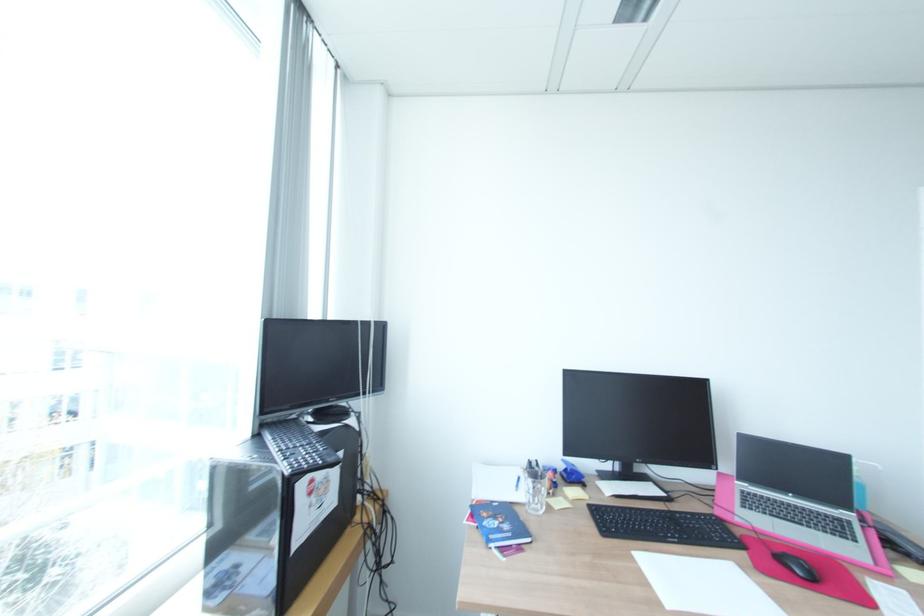
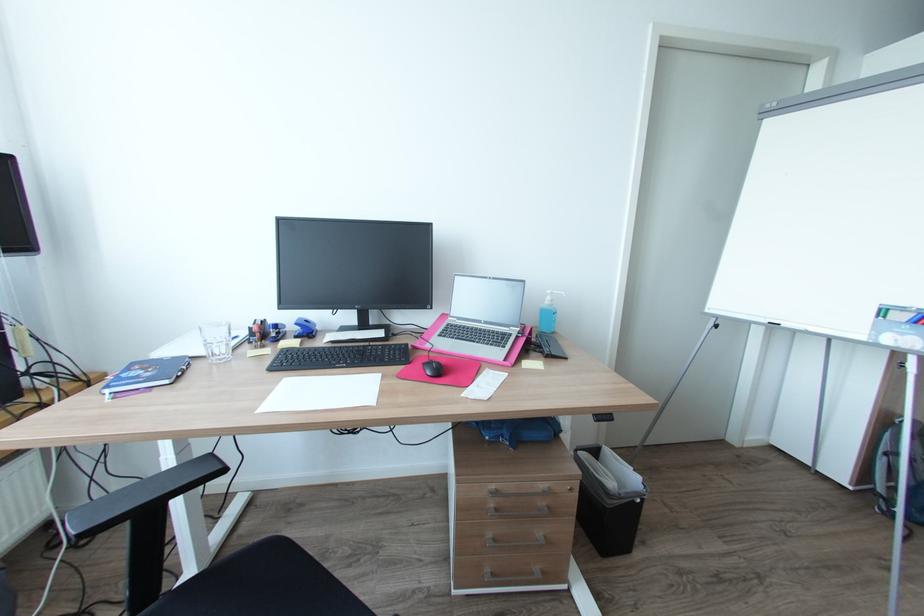
Where in the second image is the point corresponding to the point at 533,540 from the first image?

(171, 381)